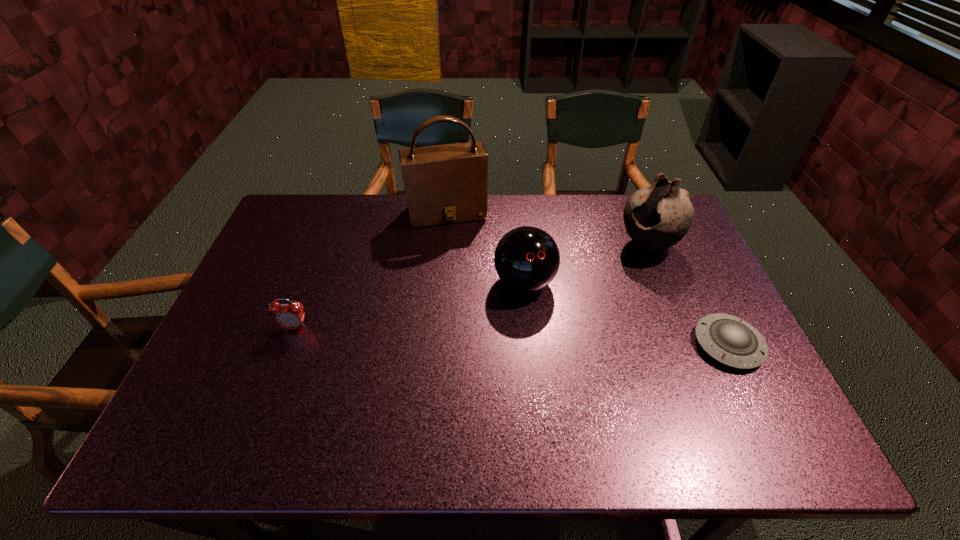
You are a GUI agent. You are given a task and a screenshot of the screen. Output one action in this format:
    pyautogui.click(x=<x>, y=<y>)
    Task: Click on the free space between the tallest object and the leftmost object
    This screenshot has width=960, height=540.
    Given the screenshot: What is the action you would take?
    pyautogui.click(x=371, y=271)

I want to click on object that is the fourth closest one to the shortest object, so click(x=290, y=316).

Identify which object is the nearest to the shoulder bag. Please provide its 2D coordinates. Your answer should be formatted as a tuple, i.e. [(x, y)], where the tuple contains the x and y coordinates of a point satisfying the conditions above.

[(526, 259)]

In order to click on free spot that satisfies the following two spatial constraints: 1. on the face of the shortest object; 2. on the right side of the leftmost object in this screenshot , I will do `click(288, 345)`.

Find the location of a particular element. vacant region that satisfies the following two spatial constraints: 1. on the face of the alarm clock; 2. on the right side of the shortest object is located at coordinates (288, 345).

Locate an element on the screen. vacant space that satisfies the following two spatial constraints: 1. on the front side of the second object from left to right; 2. on the right side of the shortest object is located at coordinates (435, 345).